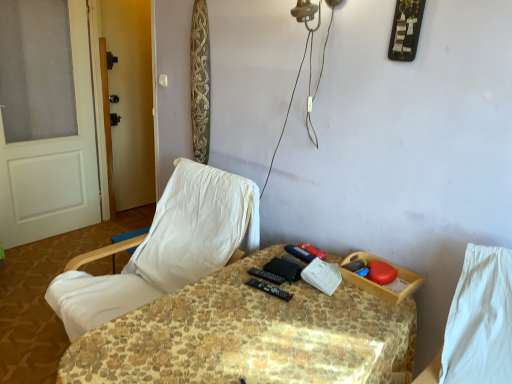
Question: Is white fabric chair at left in contact with transparent glass screen door at left?

Choices:
 (A) no
 (B) yes

Answer: (A)

Question: Can you confirm if white fabric chair at left is thinner than transparent glass screen door at left?

Choices:
 (A) no
 (B) yes

Answer: (A)

Question: Is white fabric chair at left turned away from transparent glass screen door at left?

Choices:
 (A) yes
 (B) no

Answer: (B)

Question: Is white fabric chair at left shorter than transparent glass screen door at left?

Choices:
 (A) no
 (B) yes

Answer: (B)

Question: Is white fabric chair at left wider than transparent glass screen door at left?

Choices:
 (A) yes
 (B) no

Answer: (A)

Question: Considering the positions of patterned fabric table at center and white painted wood door at left in the image, is patterned fabric table at center bigger or smaller than white painted wood door at left?

Choices:
 (A) big
 (B) small

Answer: (A)

Question: Does point (78, 339) appear closer or farther from the camera than point (79, 49)?

Choices:
 (A) farther
 (B) closer

Answer: (B)

Question: Considering the positions of patterned fabric table at center and white painted wood door at left in the image, is patterned fabric table at center wider or thinner than white painted wood door at left?

Choices:
 (A) wide
 (B) thin

Answer: (A)

Question: Would you say patterned fabric table at center is to the left or to the right of white painted wood door at left in the picture?

Choices:
 (A) left
 (B) right

Answer: (B)

Question: Does point (87, 211) appear closer or farther from the camera than point (118, 157)?

Choices:
 (A) closer
 (B) farther

Answer: (A)

Question: Based on their sizes in the image, would you say white painted wood door at left is bigger or smaller than transparent glass screen door at left?

Choices:
 (A) small
 (B) big

Answer: (A)

Question: From a real-world perspective, is white painted wood door at left physically located above or below transparent glass screen door at left?

Choices:
 (A) below
 (B) above

Answer: (A)

Question: Is white painted wood door at left spatially inside transparent glass screen door at left, or outside of it?

Choices:
 (A) inside
 (B) outside

Answer: (B)

Question: In terms of size, does black plastic remote control at center appear bigger or smaller than transparent glass screen door at left?

Choices:
 (A) small
 (B) big

Answer: (A)

Question: Is black plastic remote control at center to the left or to the right of transparent glass screen door at left in the image?

Choices:
 (A) right
 (B) left

Answer: (A)